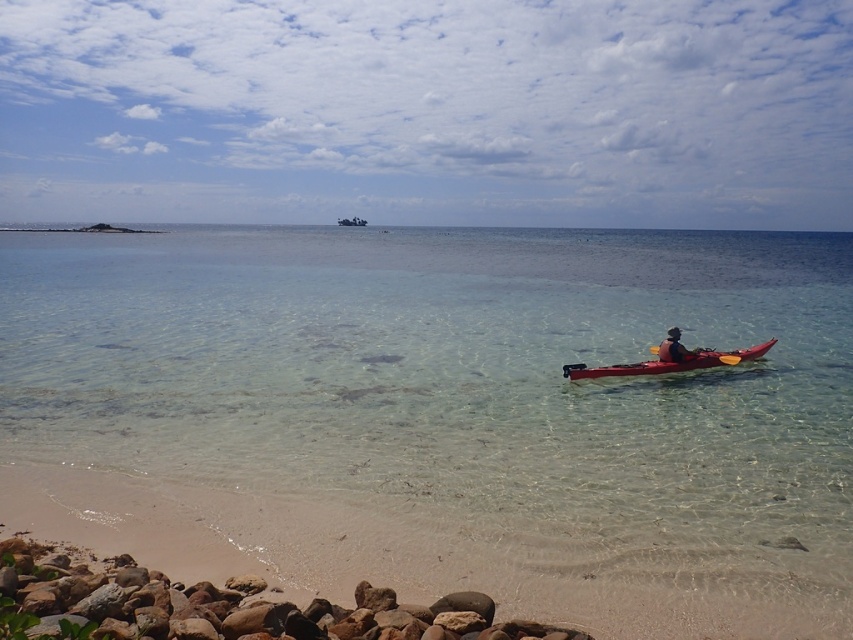
Who is shorter, rusty stone rocks at lower left or matte black kayak at center-right?

With less height is rusty stone rocks at lower left.

Does point (91, 632) lie in front of point (660, 349)?

Yes.

The width and height of the screenshot is (853, 640). What do you see at coordinates (218, 605) in the screenshot?
I see `rusty stone rocks at lower left` at bounding box center [218, 605].

At what (x,y) coordinates should I click in order to perform the action: click on rusty stone rocks at lower left. Please return your answer as a coordinate pair (x, y). This screenshot has width=853, height=640. Looking at the image, I should click on (218, 605).

Which is behind, point (437, 316) or point (363, 220)?

Point (363, 220)

Does clear glassy water at center appear on the left side of matte red kayak at center?

Incorrect, clear glassy water at center is not on the left side of matte red kayak at center.

Identify the location of clear glassy water at center. This screenshot has width=853, height=640. (448, 413).

At what (x,y) coordinates should I click in order to perform the action: click on clear glassy water at center. Please return your answer as a coordinate pair (x, y). The height and width of the screenshot is (640, 853). Looking at the image, I should click on (448, 413).

Which is more to the left, matte red kayak at center-right or matte red kayak at center?

Positioned to the left is matte red kayak at center.

Does matte red kayak at center-right have a lesser width compared to matte red kayak at center?

Indeed, matte red kayak at center-right has a lesser width compared to matte red kayak at center.

Which is behind, point (762, 346) or point (344, 218)?

Point (344, 218)

Locate an element on the screen. matte red kayak at center-right is located at coordinates (666, 362).